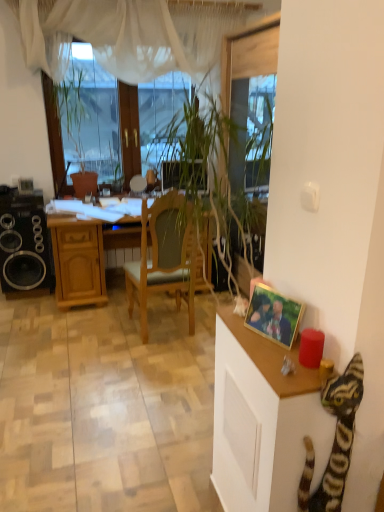
What is the approximate height of gold-framed photo at right?

The height of gold-framed photo at right is 7.56 inches.

The width and height of the screenshot is (384, 512). What do you see at coordinates (85, 115) in the screenshot?
I see `transparent glass window screen at upper left` at bounding box center [85, 115].

The height and width of the screenshot is (512, 384). Find the location of `black matte speaker at left`. black matte speaker at left is located at coordinates (24, 243).

Locate an element on the screen. wooden desk at center is located at coordinates (82, 251).

How distant is black matte speaker at left from transparent glass window screen at upper left?

black matte speaker at left and transparent glass window screen at upper left are 29.16 inches apart from each other.

From a real-world perspective, is black matte speaker at left positioned under transparent glass window screen at upper left based on gravity?

Indeed, from a real-world perspective, black matte speaker at left is positioned beneath transparent glass window screen at upper left.

Is black matte speaker at left wider than transparent glass window screen at upper left?

Yes.

Could you tell me if black matte speaker at left is turned towards transparent glass window screen at upper left?

No.

Is black matte speaker at left positioned with its back to gold-framed photo at right?

black matte speaker at left does not have its back to gold-framed photo at right.

Which object is further away from the camera, black matte speaker at left or gold-framed photo at right?

black matte speaker at left is further from the camera.

From a real-world perspective, does black matte speaker at left sit lower than gold-framed photo at right?

Correct, in the physical world, black matte speaker at left is lower than gold-framed photo at right.

Considering the relative sizes of black matte speaker at left and gold-framed photo at right in the image provided, is black matte speaker at left thinner than gold-framed photo at right?

No.

In terms of size, does striped plush cat at lower right appear bigger or smaller than wooden chair at center?

In the image, striped plush cat at lower right appears to be smaller than wooden chair at center.

Is point (309, 461) positioned in front of point (161, 197)?

Yes.

Is wooden chair at center completely or partially inside striped plush cat at lower right?

No, wooden chair at center is not inside striped plush cat at lower right.

From the image's perspective, which is below, transparent glass window screen at upper left or striped plush cat at lower right?

striped plush cat at lower right, from the image's perspective.

Is transparent glass window screen at upper left inside the boundaries of striped plush cat at lower right, or outside?

transparent glass window screen at upper left lies outside striped plush cat at lower right.

Are transparent glass window screen at upper left and striped plush cat at lower right far apart?

Yes.

Which is nearer, (74, 140) or (362, 396)?

The point (362, 396) is in front.

From a real-world perspective, who is located lower, striped plush cat at lower right or wooden cabinet at right?

wooden cabinet at right, from a real-world perspective.

Can you see striped plush cat at lower right touching wooden cabinet at right?

striped plush cat at lower right and wooden cabinet at right are clearly separated.

Is point (359, 365) closer to camera compared to point (264, 400)?

That is True.

Would you say striped plush cat at lower right is inside or outside wooden cabinet at right?

striped plush cat at lower right exists outside the volume of wooden cabinet at right.

Can you tell me how much wooden chair at center and gold-framed photo at right differ in facing direction?

109 degrees.

Is wooden chair at center looking in the opposite direction of gold-framed photo at right?

That's right, wooden chair at center is facing away from gold-framed photo at right.

Is wooden chair at center at the left side of gold-framed photo at right?

Yes, wooden chair at center is to the left of gold-framed photo at right.

Measure the distance between wooden chair at center and gold-framed photo at right.

wooden chair at center is 1.07 meters away from gold-framed photo at right.

Does wooden cabinet at right lie behind striped plush cat at lower right?

Yes, it is.

Can you tell me how much wooden cabinet at right and striped plush cat at lower right differ in facing direction?

The angular difference between wooden cabinet at right and striped plush cat at lower right is 90 degrees.

From a real-world perspective, is wooden cabinet at right on striped plush cat at lower right?

No, from a real-world perspective, wooden cabinet at right is not over striped plush cat at lower right

Would you say wooden cabinet at right is inside or outside striped plush cat at lower right?

The correct answer is: outside.

The image size is (384, 512). I want to click on window screen located on the right of black matte speaker at left, so click(85, 115).

Locate an element on the screen. The height and width of the screenshot is (512, 384). picture frame below the black matte speaker at left (from the image's perspective) is located at coordinates (274, 315).

Which object lies nearer to the anchor point transparent glass window screen at upper left, wooden desk at center or wooden cabinet at right?

The object closer to transparent glass window screen at upper left is wooden desk at center.

When comparing their distances from wooden desk at center, does wooden chair at center or wooden cabinet at right seem further?

wooden cabinet at right lies further to wooden desk at center than the other object.

When comparing their distances from wooden desk at center, does gold-framed photo at right or transparent glass window screen at upper left seem closer?

transparent glass window screen at upper left is closer to wooden desk at center.

Considering their positions, is wooden cabinet at right positioned further to transparent glass window screen at upper left than wooden desk at center?

Based on the image, wooden cabinet at right appears to be further to transparent glass window screen at upper left.

Which object lies nearer to the anchor point black matte speaker at left, wooden cabinet at right or gold-framed photo at right?

wooden cabinet at right is closer to black matte speaker at left.

Based on their spatial positions, is striped plush cat at lower right or transparent glass window screen at upper left further from gold-framed photo at right?

The object further to gold-framed photo at right is transparent glass window screen at upper left.

Considering their positions, is black matte speaker at left positioned further to wooden chair at center than transparent glass window screen at upper left?

The object further to wooden chair at center is transparent glass window screen at upper left.

Which object lies nearer to the anchor point striped plush cat at lower right, transparent glass window screen at upper left or wooden chair at center?

wooden chair at center.

I want to click on picture frame between striped plush cat at lower right and wooden chair at center along the z-axis, so click(x=274, y=315).

The image size is (384, 512). In order to click on picture frame positioned between wooden cabinet at right and wooden chair at center from near to far in this screenshot , I will do `click(274, 315)`.

The width and height of the screenshot is (384, 512). Identify the location of cabinetry located between striped plush cat at lower right and transparent glass window screen at upper left in the depth direction. (263, 420).

Image resolution: width=384 pixels, height=512 pixels. I want to click on desk positioned between wooden cabinet at right and black matte speaker at left from near to far, so click(82, 251).